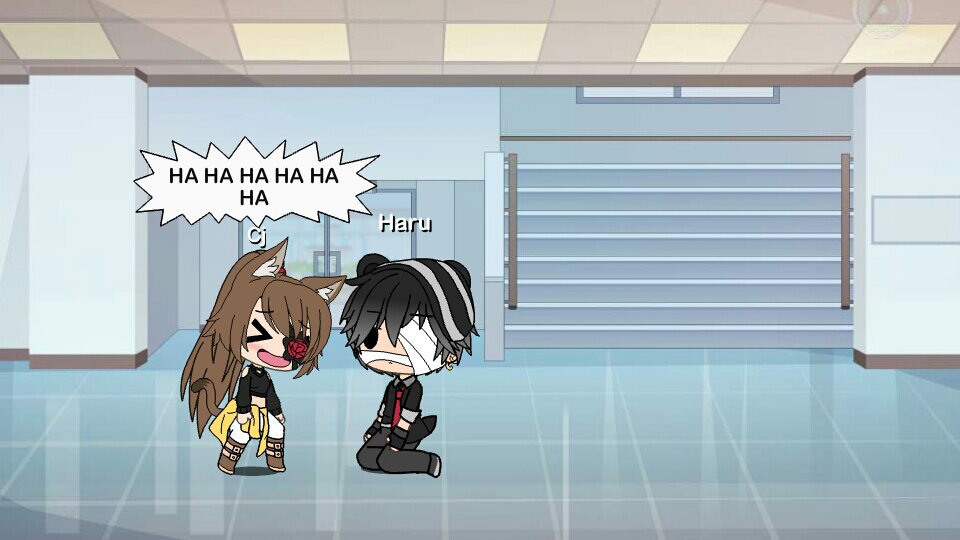
Where is `floor`? The height and width of the screenshot is (540, 960). floor is located at coordinates (492, 453).